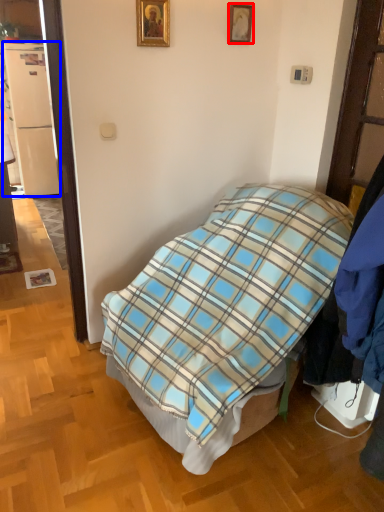
Question: Which object is further to the camera taking this photo, picture frame (highlighted by a red box) or refrigerator (highlighted by a blue box)?

Choices:
 (A) picture frame
 (B) refrigerator

Answer: (B)